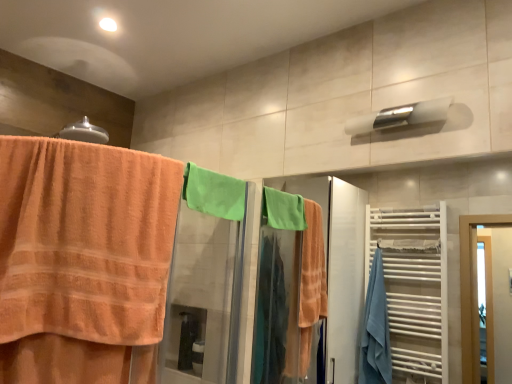
Question: Is satin silver towel bar at upper center, which ranks as the 2th towel bar in left-to-right order, in front of or behind orange terry cloth towel at left in the image?

Choices:
 (A) front
 (B) behind

Answer: (B)

Question: From the image's perspective, is satin silver towel bar at upper center, which ranks as the 2th towel bar in left-to-right order, positioned above or below orange terry cloth towel at left?

Choices:
 (A) above
 (B) below

Answer: (A)

Question: Estimate the real-world distances between objects in this image. Which object is farther from the satin silver towel bar at upper center, which ranks as the 2th towel bar in left-to-right order?

Choices:
 (A) white glossy towel bar at upper center, acting as the second towel bar starting from the right
 (B) green cotton towel at center
 (C) orange terry cloth towel at left
 (D) green towel at upper right

Answer: (D)

Question: Which object is the farthest from the green towel at upper right?

Choices:
 (A) orange terry cloth towel at left
 (B) white glossy towel bar at upper center, the first towel bar in the left-to-right sequence
 (C) satin silver towel bar at upper center, placed as the first towel bar when sorted from right to left
 (D) green cotton towel at center

Answer: (C)